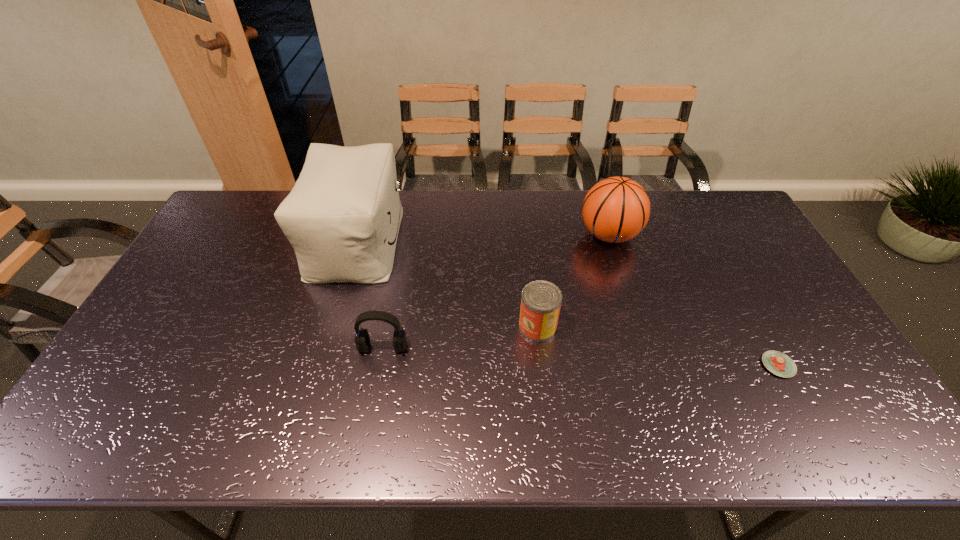
This screenshot has height=540, width=960. In order to click on cushion in this screenshot , I will do `click(342, 217)`.

Find the location of a particular element. the second object from right to left is located at coordinates (616, 209).

What are the coordinates of `the second tallest object` in the screenshot? It's located at (616, 209).

What are the coordinates of `headset` in the screenshot? It's located at (362, 339).

Locate an element on the screen. This screenshot has width=960, height=540. can is located at coordinates (541, 300).

This screenshot has width=960, height=540. I want to click on the rightmost object, so click(778, 363).

Find the location of a particular element. This screenshot has height=540, width=960. the shortest object is located at coordinates (778, 363).

Image resolution: width=960 pixels, height=540 pixels. In order to click on vacant space located on the side of the tallest object with the smiley face in this screenshot , I will do `click(448, 242)`.

Locate an element on the screen. The image size is (960, 540). free location located 0.310m on the right of the fourth object from left to right is located at coordinates (732, 235).

Identify the location of vacant space located on the headband of the headset. The image size is (960, 540). (368, 429).